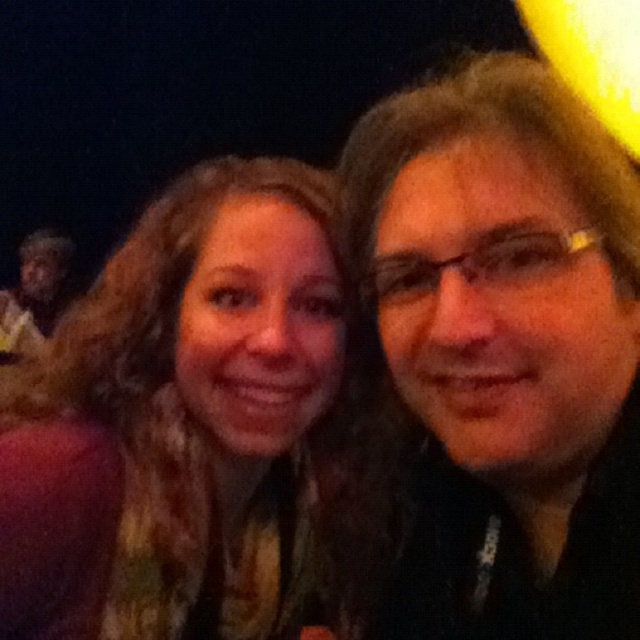
You are a photographer trying to adjust the lighting for a portrait. You notice the multicolored scarf at center and the dark skin face at left. Which object should you focus on to ensure proper exposure, considering their sizes?

The dark skin face at left is larger than the multicolored scarf at center, so focusing on the larger dark skin face at left would ensure proper exposure for the main subject.

You are a photographer trying to adjust the lighting for a photo shoot. You notice the matte black hair at center and the multicolored scarf at center in the frame. Which object occupies more space horizontally in the image?

The multicolored scarf at center has a greater width than the matte black hair at center, so it occupies more horizontal space in the image.

You are a photographer adjusting lighting for a portrait. You notice the matte black hair at center and dark skin face at left in your frame. Which of these elements is positioned lower in the image?

The matte black hair at center is positioned lower in the image because it is not as tall as the dark skin face at left.